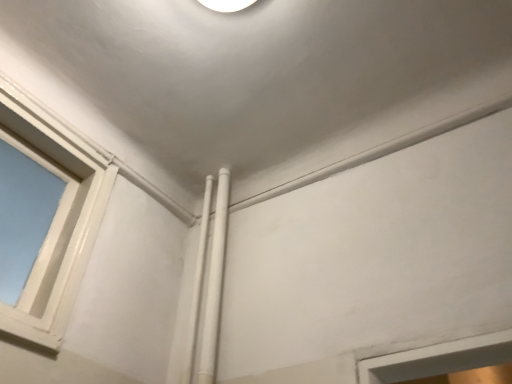
This screenshot has height=384, width=512. Find the location of `white glossy window at upper left`. white glossy window at upper left is located at coordinates pos(55,215).

Measure the distance between white glossy window at upper left and camera.

38.42 inches.

The image size is (512, 384). What do you see at coordinates (55, 215) in the screenshot? I see `white glossy window at upper left` at bounding box center [55, 215].

Where is `white glossy window at upper left`? The image size is (512, 384). white glossy window at upper left is located at coordinates (55, 215).